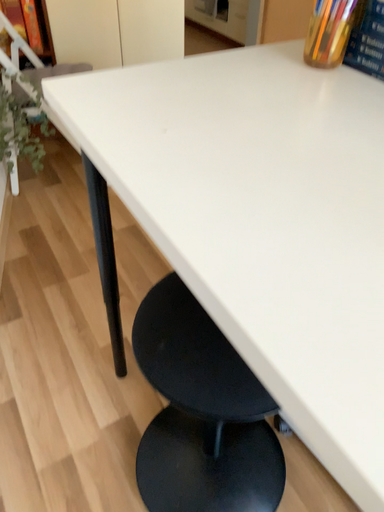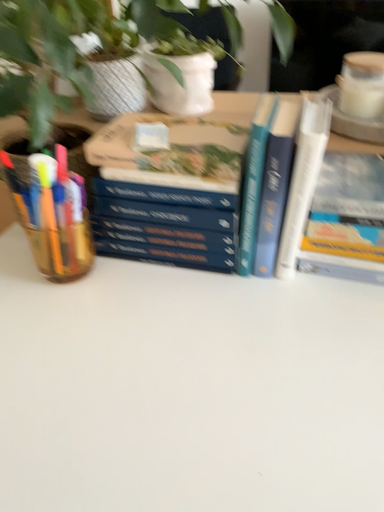
Question: How did the camera likely rotate when shooting the video?

Choices:
 (A) rotated upward
 (B) rotated downward

Answer: (A)